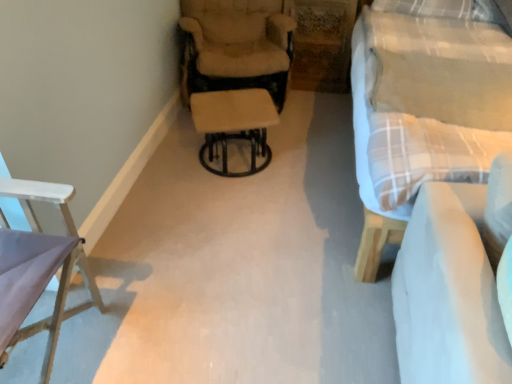
Question: Is the position of beige fabric chair at center, placed as the second chair when sorted from bottom to top, more distant than that of black metal stool at center?

Choices:
 (A) no
 (B) yes

Answer: (B)

Question: From a real-world perspective, is beige fabric chair at center, the 2th chair when ordered from front to back, physically below black metal stool at center?

Choices:
 (A) yes
 (B) no

Answer: (B)

Question: Is beige fabric chair at center, the 2th chair when ordered from front to back, directly adjacent to black metal stool at center?

Choices:
 (A) no
 (B) yes

Answer: (A)

Question: From a real-world perspective, is beige fabric chair at center, placed as the second chair when sorted from bottom to top, over black metal stool at center?

Choices:
 (A) no
 (B) yes

Answer: (B)

Question: From the image's perspective, would you say beige fabric chair at center, placed as the second chair when sorted from bottom to top, is shown under black metal stool at center?

Choices:
 (A) yes
 (B) no

Answer: (B)

Question: Does beige fabric chair at center, arranged as the 1th chair when viewed from the top, have a lesser width compared to black metal stool at center?

Choices:
 (A) no
 (B) yes

Answer: (A)

Question: Can you confirm if plaid fabric studio couch at right is thinner than white wood chair at left, positioned as the first chair in left-to-right order?

Choices:
 (A) no
 (B) yes

Answer: (A)

Question: Is white wood chair at left, which appears as the second chair when viewed from the top, a part of plaid fabric studio couch at right?

Choices:
 (A) no
 (B) yes

Answer: (A)

Question: From the image's perspective, is plaid fabric studio couch at right located beneath white wood chair at left, positioned as the first chair in left-to-right order?

Choices:
 (A) yes
 (B) no

Answer: (B)

Question: Can you confirm if plaid fabric studio couch at right is smaller than white wood chair at left, positioned as the first chair in left-to-right order?

Choices:
 (A) no
 (B) yes

Answer: (A)

Question: Is plaid fabric studio couch at right directly adjacent to white wood chair at left, acting as the 1th chair starting from the front?

Choices:
 (A) yes
 (B) no

Answer: (B)

Question: Considering the relative positions of plaid fabric studio couch at right and white wood chair at left, acting as the 1th chair starting from the front, in the image provided, is plaid fabric studio couch at right in front of white wood chair at left, acting as the 1th chair starting from the front,?

Choices:
 (A) no
 (B) yes

Answer: (A)

Question: From a real-world perspective, is beige fabric chair at center, the first chair from the right, physically above white fabric couch at lower right?

Choices:
 (A) yes
 (B) no

Answer: (B)